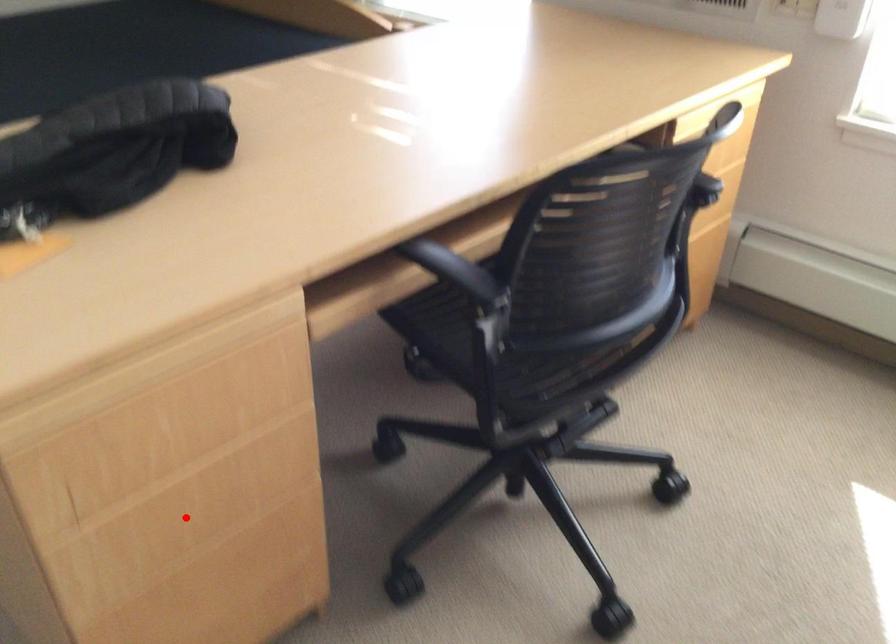
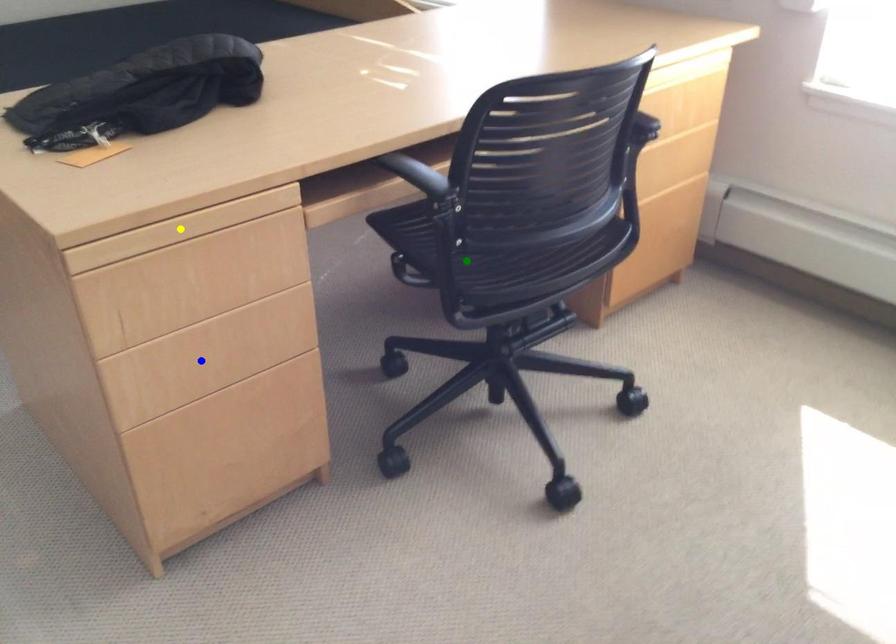
Question: I am providing you with two images of the same scene from different viewpoints. A red point is marked on the first image. You are given multiple points on the second image. Which mark in image 2 goes with the point in image 1?

Choices:
 (A) yellow point
 (B) green point
 (C) blue point

Answer: (C)